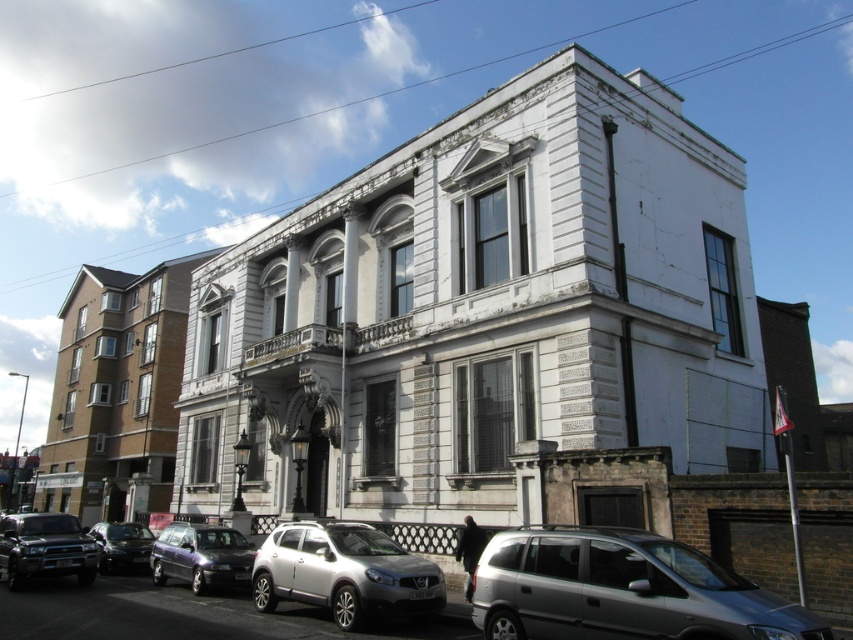
Between point (281, 596) and point (167, 557), which one is positioned in front?

Point (281, 596) is in front.

Looking at this image, between silver metallic suv at lower center and metallic purple car at lower left, which one appears on the right side from the viewer's perspective?

silver metallic suv at lower center is more to the right.

Who is more forward, (305, 524) or (209, 538)?

Point (305, 524) is more forward.

Locate an element on the screen. silver metallic suv at lower center is located at coordinates (344, 572).

Can you confirm if silver metallic van at center is bigger than metallic purple car at lower left?

Incorrect, silver metallic van at center is not larger than metallic purple car at lower left.

Is point (741, 618) farther from viewer compared to point (250, 561)?

That is False.

What do you see at coordinates (621, 589) in the screenshot? The height and width of the screenshot is (640, 853). I see `silver metallic van at center` at bounding box center [621, 589].

This screenshot has height=640, width=853. I want to click on silver metallic van at center, so click(621, 589).

Who is lower down, silver metallic van at center or silver metallic suv at lower center?

silver metallic suv at lower center is lower down.

Is silver metallic van at center bigger than silver metallic suv at lower center?

Actually, silver metallic van at center might be smaller than silver metallic suv at lower center.

Measure the distance between silver metallic van at center and camera.

silver metallic van at center and camera are 63.94 feet apart from each other.

Where is `silver metallic van at center`? The width and height of the screenshot is (853, 640). silver metallic van at center is located at coordinates (621, 589).